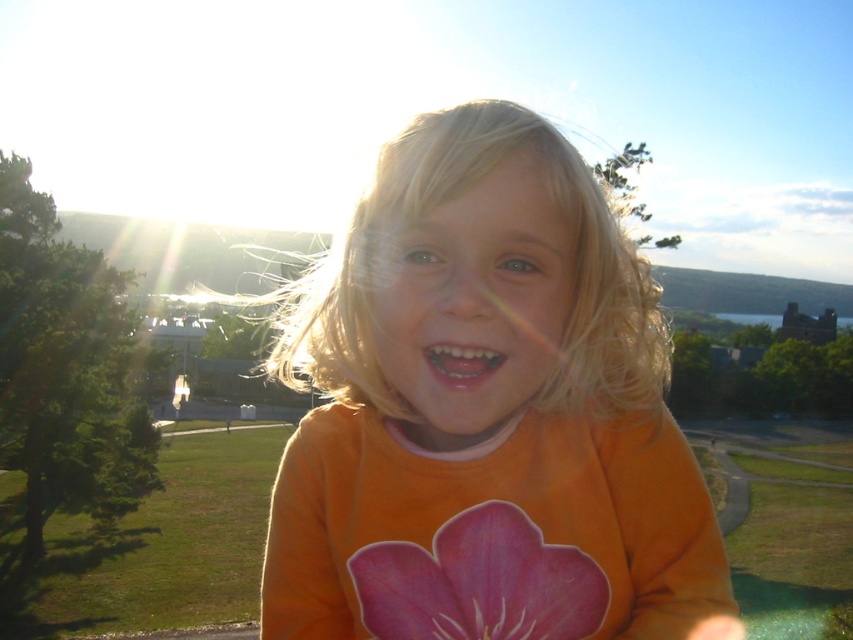
You are a photographer trying to capture a closeup of the pink paper flower at center while ensuring the orange matte shirt at center is still visible in the frame. Based on their sizes, which object should you focus on to ensure both are in the shot?

The orange matte shirt at center is larger than the pink paper flower at center, so focusing on the orange matte shirt at center will allow both objects to fit within the frame since it occupies more space.

The child is wearing an orange matte shirt at center and has a pink paper flower at center. Which item is bigger?

The orange matte shirt at center is larger than the pink paper flower at center.